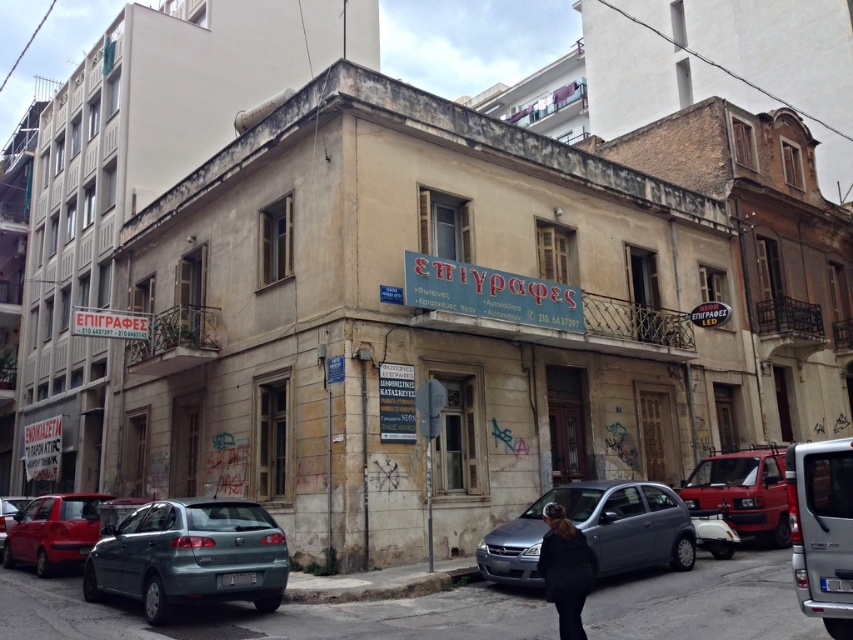
Question: Can you confirm if teal matte hatchback at lower left is wider than shiny red sedan at lower left?

Choices:
 (A) yes
 (B) no

Answer: (B)

Question: Which object is positioned closest to the matte red van at center?

Choices:
 (A) blue metallic car at center
 (B) matte red car at lower left
 (C) teal matte hatchback at lower left
 (D) shiny red sedan at lower left

Answer: (A)

Question: Is silver metallic van at lower right bigger than matte red car at lower left?

Choices:
 (A) no
 (B) yes

Answer: (A)

Question: Does silver metallic van at lower right have a smaller size compared to shiny red sedan at lower left?

Choices:
 (A) no
 (B) yes

Answer: (B)

Question: Estimate the real-world distances between objects in this image. Which object is closer to the matte red car at lower left?

Choices:
 (A) shiny red sedan at lower left
 (B) matte red van at center

Answer: (A)

Question: Among these objects, which one is farthest from the camera?

Choices:
 (A) silver metallic van at lower right
 (B) dark brown fur coat at lower center
 (C) matte red van at center
 (D) blue metallic car at center

Answer: (C)